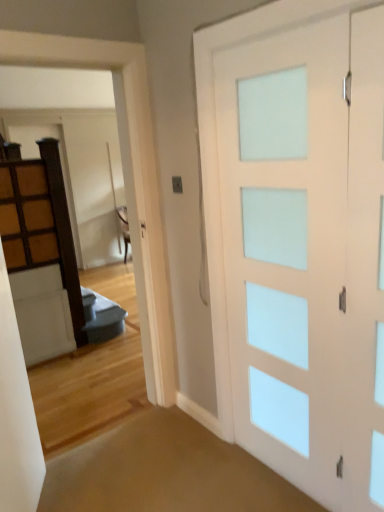
What is the approximate width of wooden cabinet at left?

wooden cabinet at left is 3.17 inches wide.

Image resolution: width=384 pixels, height=512 pixels. What are the coordinates of `wooden cabinet at left` in the screenshot? It's located at (27, 217).

In the scene shown: Is wooden cabinet at left aimed at white frosted glass barn door at right?

Yes, wooden cabinet at left is oriented towards white frosted glass barn door at right.

How far apart are wooden cabinet at left and white frosted glass barn door at right?

wooden cabinet at left is 2.07 meters from white frosted glass barn door at right.

Is wooden cabinet at left thinner than white frosted glass barn door at right?

No.

Which is correct: white frosted glass door at upper center is inside wooden cabinet at left, or outside of it?

white frosted glass door at upper center is not enclosed by wooden cabinet at left.

From the picture: Is white frosted glass door at upper center closer to camera compared to wooden cabinet at left?

Yes, it is.

From the image's perspective, is white frosted glass door at upper center positioned above or below wooden cabinet at left?

Clearly, from the image's perspective, white frosted glass door at upper center is below wooden cabinet at left.

Is point (0, 42) positioned behind point (18, 229)?

No, (0, 42) is closer to viewer.

Is wooden cabinet at left next to white frosted glass door at upper center and touching it?

No.

From the image's perspective, relative to white frosted glass door at upper center, is wooden cabinet at left above or below?

wooden cabinet at left is above white frosted glass door at upper center.

From a real-world perspective, who is located lower, wooden cabinet at left or white frosted glass door at upper center?

In real-world perspective, white frosted glass door at upper center is lower.

Can you tell me how much wooden cabinet at left and white frosted glass door at upper center differ in facing direction?

wooden cabinet at left and white frosted glass door at upper center are facing 0.278 degrees away from each other.

Does white frosted glass door at upper center appear on the left side of white frosted glass barn door at right?

Yes.

From a real-world perspective, which object stands above the other?

white frosted glass door at upper center, from a real-world perspective.

Considering the relative sizes of white frosted glass door at upper center and white frosted glass barn door at right in the image provided, is white frosted glass door at upper center thinner than white frosted glass barn door at right?

Incorrect, the width of white frosted glass door at upper center is not less than that of white frosted glass barn door at right.

Considering the relative sizes of white frosted glass door at upper center and white frosted glass barn door at right in the image provided, is white frosted glass door at upper center shorter than white frosted glass barn door at right?

No, white frosted glass door at upper center is not shorter than white frosted glass barn door at right.

Considering the relative sizes of white frosted glass barn door at right and white frosted glass door at upper center in the image provided, is white frosted glass barn door at right smaller than white frosted glass door at upper center?

Yes.

Is white frosted glass barn door at right in front of white frosted glass door at upper center?

Yes, the depth of white frosted glass barn door at right is less than that of white frosted glass door at upper center.

Is white frosted glass barn door at right completely or partially outside of white frosted glass door at upper center?

white frosted glass barn door at right is positioned outside white frosted glass door at upper center.

Is white frosted glass barn door at right far away from white frosted glass door at upper center?

white frosted glass barn door at right is near white frosted glass door at upper center, not far away.

Does white frosted glass barn door at right have a greater height compared to wooden cabinet at left?

Yes.

Which is in front, point (329, 412) or point (28, 166)?

The point (329, 412) is closer to the camera.

Choose the correct answer: Is white frosted glass barn door at right inside wooden cabinet at left or outside it?

The correct answer is: outside.

Is white frosted glass barn door at right positioned far away from wooden cabinet at left?

Yes, white frosted glass barn door at right and wooden cabinet at left are quite far apart.

Locate an element on the screen. The height and width of the screenshot is (512, 384). cabinetry on the left of white frosted glass barn door at right is located at coordinates (27, 217).

Locate an element on the screen. garage door in front of the wooden cabinet at left is located at coordinates (133, 174).

From the picture: Based on their spatial positions, is white frosted glass barn door at right or white frosted glass door at upper center closer to wooden cabinet at left?

The object closer to wooden cabinet at left is white frosted glass door at upper center.

Looking at the image, which one is located further to white frosted glass door at upper center, wooden cabinet at left or white frosted glass barn door at right?

wooden cabinet at left lies further to white frosted glass door at upper center than the other object.

When comparing their distances from wooden cabinet at left, does white frosted glass door at upper center or white frosted glass barn door at right seem further?

The object further to wooden cabinet at left is white frosted glass barn door at right.

Which object lies nearer to the anchor point white frosted glass barn door at right, wooden cabinet at left or white frosted glass door at upper center?

Based on the image, white frosted glass door at upper center appears to be nearer to white frosted glass barn door at right.

Considering their positions, is white frosted glass barn door at right positioned closer to white frosted glass door at upper center than wooden cabinet at left?

white frosted glass barn door at right is positioned closer to the anchor white frosted glass door at upper center.

From the image, which object appears to be nearer to white frosted glass barn door at right, white frosted glass door at upper center or wooden cabinet at left?

Among the two, white frosted glass door at upper center is located nearer to white frosted glass barn door at right.

This screenshot has height=512, width=384. I want to click on garage door between white frosted glass barn door at right and wooden cabinet at left along the z-axis, so click(133, 174).